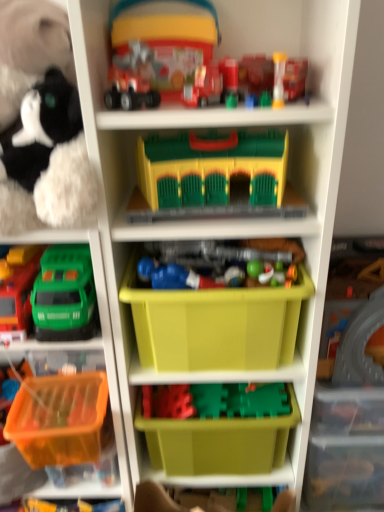
Question: Is blue plastic toy at center, positioned as the third toy in bottom-to-top order, outside translucent plastic toy at upper center, which is the eighth toy from bottom to top?

Choices:
 (A) no
 (B) yes

Answer: (B)

Question: Is the position of blue plastic toy at center, positioned as the third toy in bottom-to-top order, less distant than that of translucent plastic toy at upper center, which is the eighth toy from bottom to top?

Choices:
 (A) no
 (B) yes

Answer: (A)

Question: From a real-world perspective, does blue plastic toy at center, positioned as the third toy in bottom-to-top order, stand above translucent plastic toy at upper center, which is the eighth toy from bottom to top?

Choices:
 (A) yes
 (B) no

Answer: (B)

Question: Does blue plastic toy at center, positioned as the third toy in bottom-to-top order, come behind translucent plastic toy at upper center, which is the eighth toy from bottom to top?

Choices:
 (A) yes
 (B) no

Answer: (A)

Question: Considering the relative positions of blue plastic toy at center, the seventh toy viewed from the top, and translucent plastic toy at upper center, placed as the 2th toy when sorted from top to bottom, in the image provided, is blue plastic toy at center, the seventh toy viewed from the top, to the left of translucent plastic toy at upper center, placed as the 2th toy when sorted from top to bottom, from the viewer's perspective?

Choices:
 (A) yes
 (B) no

Answer: (A)

Question: From a real-world perspective, is blue plastic toy at center, the seventh toy viewed from the top, beneath translucent plastic toy at upper center, which is the eighth toy from bottom to top?

Choices:
 (A) no
 (B) yes

Answer: (B)

Question: From a real-world perspective, is translucent plastic cup at upper center, which is counted as the 6th toy, starting from the bottom, under blue plastic toy at center, positioned as the third toy in bottom-to-top order?

Choices:
 (A) yes
 (B) no

Answer: (B)

Question: Does translucent plastic cup at upper center, which is counted as the 6th toy, starting from the bottom, have a lesser width compared to blue plastic toy at center, positioned as the third toy in bottom-to-top order?

Choices:
 (A) no
 (B) yes

Answer: (B)

Question: Does translucent plastic cup at upper center, which is the fourth toy in top-to-bottom order, appear on the right side of blue plastic toy at center, positioned as the third toy in bottom-to-top order?

Choices:
 (A) no
 (B) yes

Answer: (B)

Question: Is translucent plastic cup at upper center, which is counted as the 6th toy, starting from the bottom, closer to the viewer compared to blue plastic toy at center, positioned as the third toy in bottom-to-top order?

Choices:
 (A) no
 (B) yes

Answer: (B)

Question: Is translucent plastic cup at upper center, which is counted as the 6th toy, starting from the bottom, oriented away from blue plastic toy at center, positioned as the third toy in bottom-to-top order?

Choices:
 (A) no
 (B) yes

Answer: (A)

Question: Does translucent plastic cup at upper center, which is the fourth toy in top-to-bottom order, appear on the left side of blue plastic toy at center, the seventh toy viewed from the top?

Choices:
 (A) no
 (B) yes

Answer: (A)

Question: Is translucent plastic cup at upper center, which is the fourth toy in top-to-bottom order, oriented away from translucent orange plastic basket at lower left, acting as the third storage box starting from the top?

Choices:
 (A) no
 (B) yes

Answer: (A)